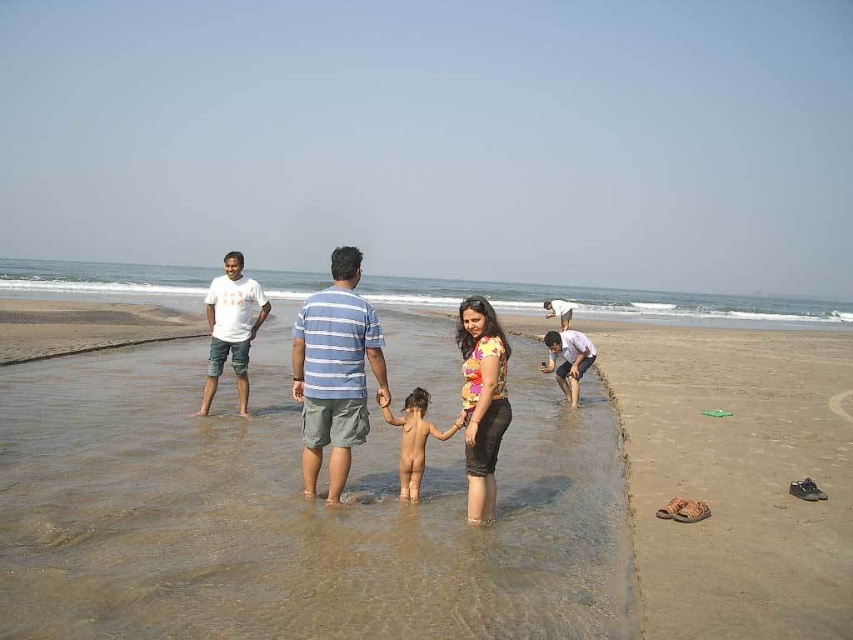
Question: Is brown sand at center above smooth skin child at center?

Choices:
 (A) no
 (B) yes

Answer: (A)

Question: Which object is closer to the camera taking this photo?

Choices:
 (A) clear water at center
 (B) striped cotton shirt at center

Answer: (B)

Question: Can you confirm if clear water at center is thinner than white cotton t-shirt at left?

Choices:
 (A) yes
 (B) no

Answer: (B)

Question: Which of the following is the closest to the observer?

Choices:
 (A) (19, 509)
 (B) (332, 312)
 (C) (469, 500)

Answer: (A)

Question: Which object is farther from the camera taking this photo?

Choices:
 (A) matte striped shirt at center
 (B) brown sand at center
 (C) clear water at center
 (D) white cotton t-shirt at left

Answer: (C)

Question: Is nude skin at center wider than smooth skin child at center?

Choices:
 (A) no
 (B) yes

Answer: (B)